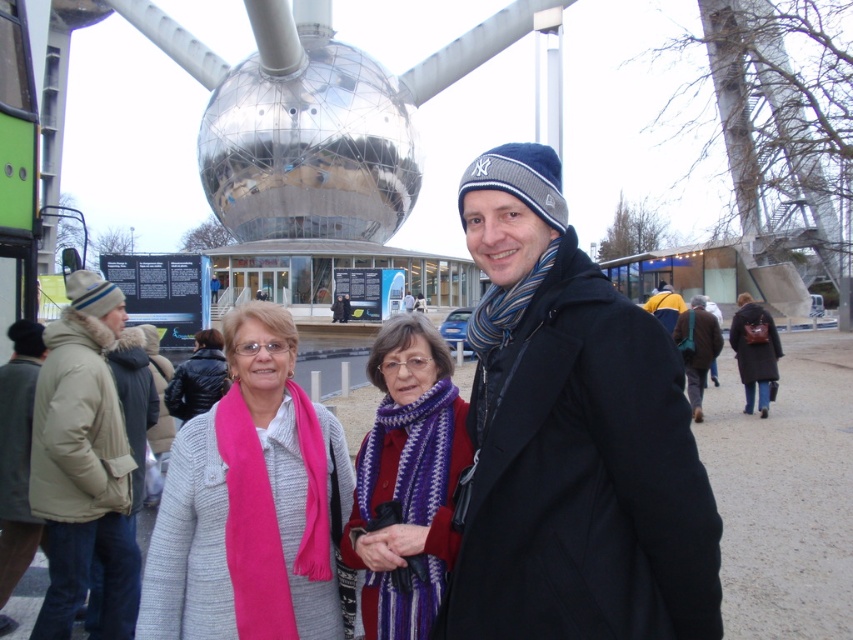
Based on the photo, is knitted scarf at center further to camera compared to dark blue wool coat at right?

No.

This screenshot has height=640, width=853. What do you see at coordinates (407, 477) in the screenshot?
I see `knitted scarf at center` at bounding box center [407, 477].

The width and height of the screenshot is (853, 640). Identify the location of knitted scarf at center. (407, 477).

Is point (405, 554) positioned before point (705, 337)?

Yes.

The height and width of the screenshot is (640, 853). Find the location of `knitted scarf at center`. knitted scarf at center is located at coordinates (407, 477).

Who is shorter, dark blue woolen coat at center or dark blue wool coat at right?

With less height is dark blue wool coat at right.

Is point (573, 634) more distant than point (746, 344)?

No, (573, 634) is closer to viewer.

Between point (479, 200) and point (759, 378), which one is positioned in front?

Point (479, 200)

I want to click on dark blue woolen coat at center, so click(572, 438).